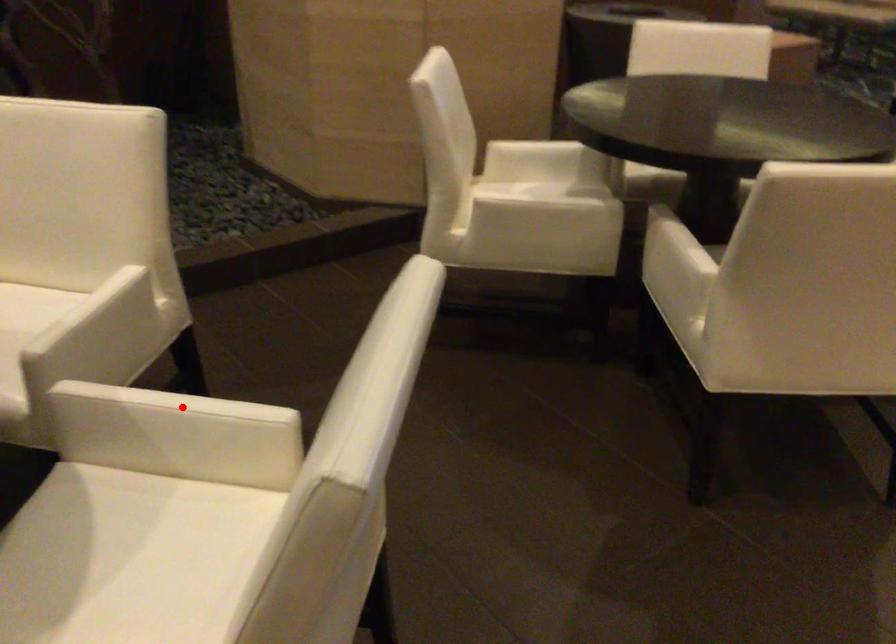
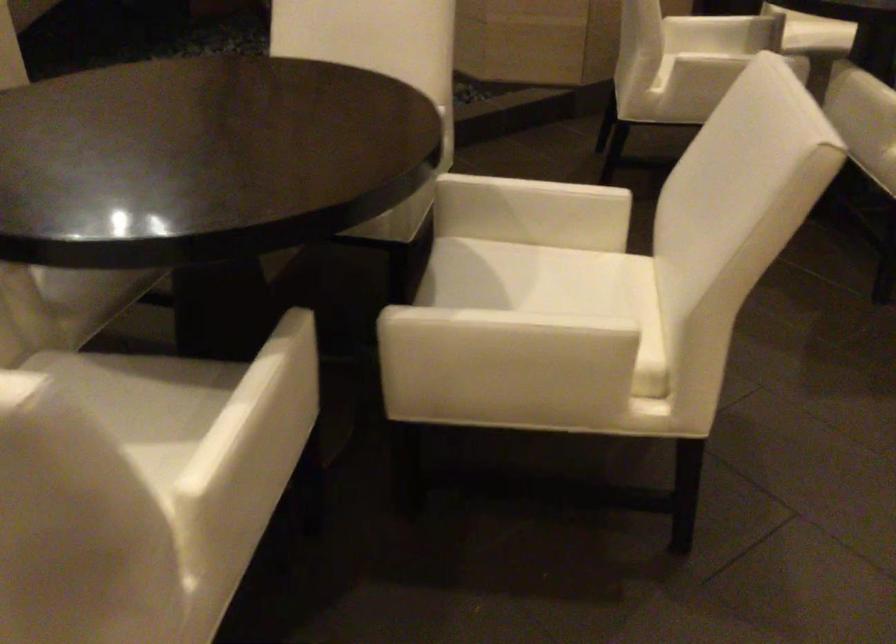
In the second image, find the point that corresponds to the highlighted location in the first image.

(538, 185)